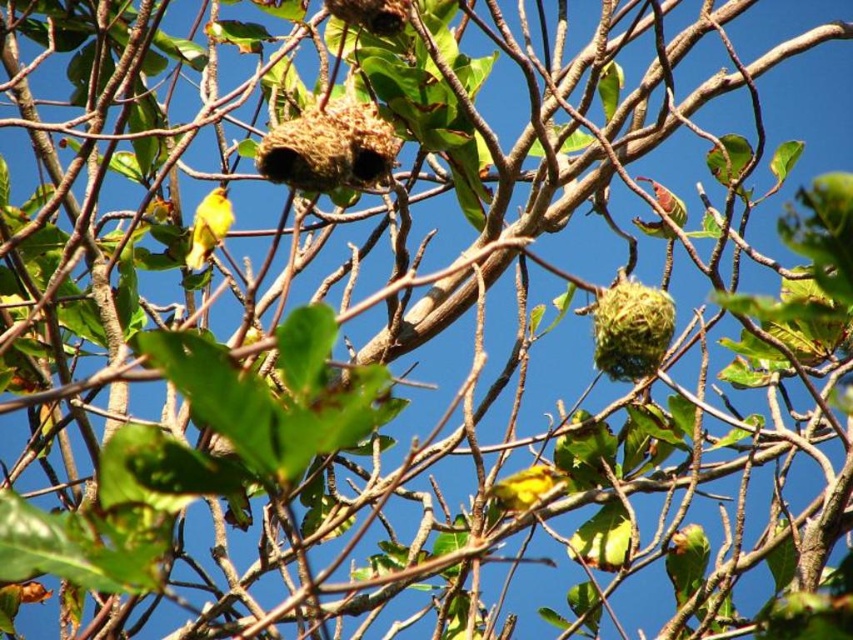
Does yellow matte bird at left lie in front of green matte bird at upper right?

No, yellow matte bird at left is behind green matte bird at upper right.

This screenshot has height=640, width=853. Identify the location of yellow matte bird at left. click(207, 227).

I want to click on yellow matte bird at left, so click(x=207, y=227).